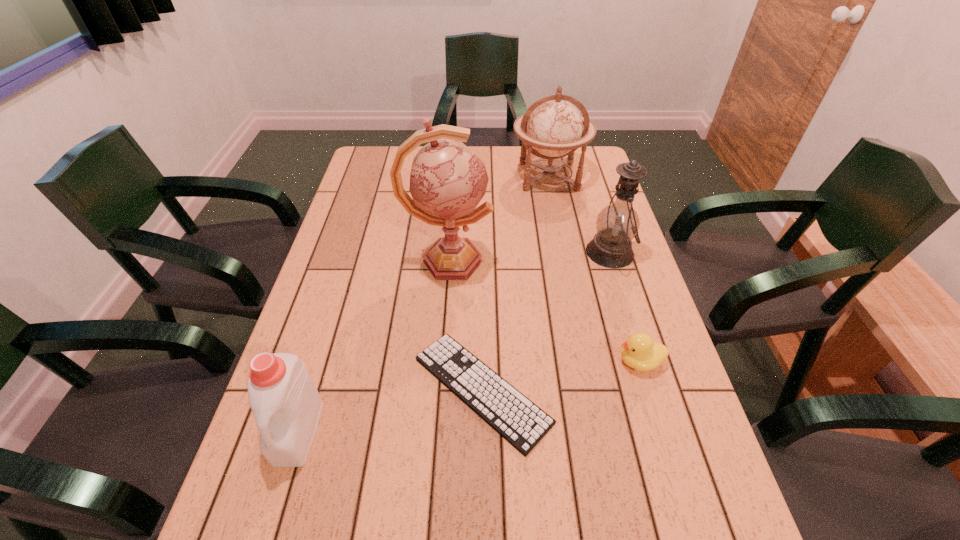
Locate an element on the screen. The height and width of the screenshot is (540, 960). the nearer globe is located at coordinates click(x=447, y=180).

In order to click on the left globe in this screenshot , I will do `click(447, 180)`.

Where is `the farther globe`? the farther globe is located at coordinates (552, 125).

At what (x,y) coordinates should I click in order to perform the action: click on the farthest object. Please return your answer as a coordinate pair (x, y). The width and height of the screenshot is (960, 540). Looking at the image, I should click on (552, 125).

At what (x,y) coordinates should I click in order to perform the action: click on oil lamp. Please return your answer as a coordinate pair (x, y). This screenshot has width=960, height=540. Looking at the image, I should click on (617, 224).

Locate an element on the screen. This screenshot has width=960, height=540. the third shortest object is located at coordinates (285, 402).

Find the location of `the leftmost object`. the leftmost object is located at coordinates (285, 402).

Identify the location of the second shortest object. The height and width of the screenshot is (540, 960). (640, 352).

Locate an element on the screen. the shortest object is located at coordinates (517, 419).

Find the location of a particular element. The height and width of the screenshot is (540, 960). blank space located 0.390m on the front-facing side of the taller globe is located at coordinates (627, 261).